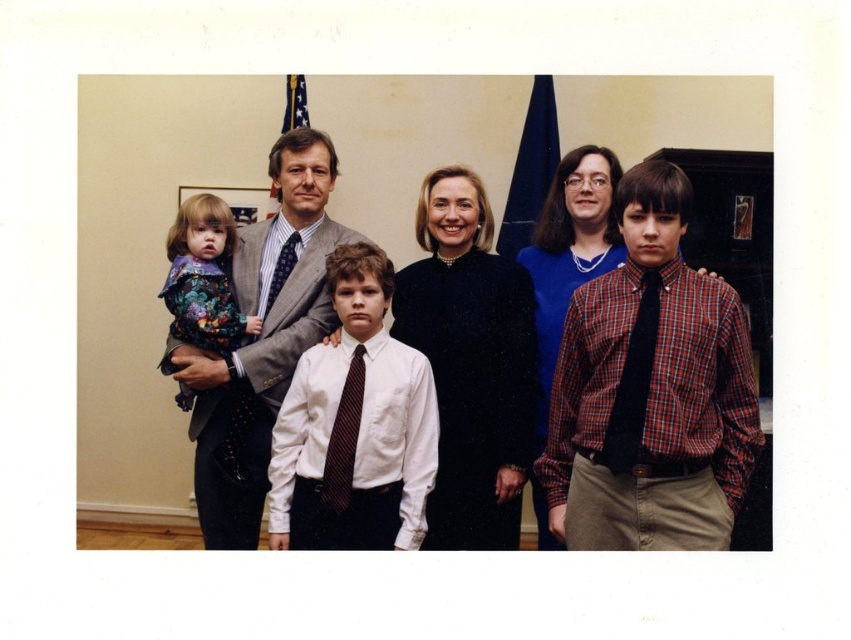
Question: Is the position of white shirt with tie at center less distant than that of striped fabric tie at center?

Choices:
 (A) no
 (B) yes

Answer: (A)

Question: Does matte black dress at center have a larger size compared to polka dot silk tie at center?

Choices:
 (A) yes
 (B) no

Answer: (A)

Question: Which point is farther from the camera taking this photo?

Choices:
 (A) (226, 216)
 (B) (621, 401)
 (C) (353, 413)
 (D) (238, 504)

Answer: (D)

Question: Which is nearer to the black silk tie at right?

Choices:
 (A) matte black dress at center
 (B) polka dot silk tie at center
 (C) white shirt with tie at center

Answer: (C)

Question: Which of the following is the closest to the observer?

Choices:
 (A) black silk tie at right
 (B) striped fabric tie at center

Answer: (A)

Question: Does white shirt with tie at center appear under floral fabric dress at left?

Choices:
 (A) yes
 (B) no

Answer: (A)